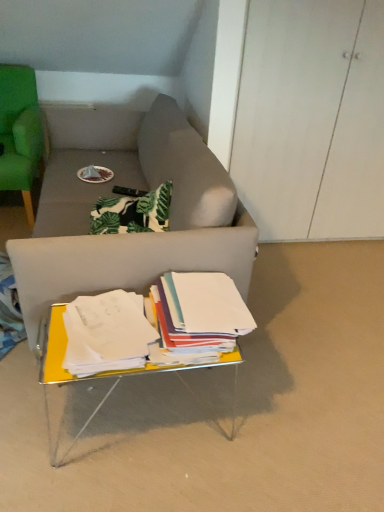
You are a GUI agent. You are given a task and a screenshot of the screen. Output one action in this format:
    pyautogui.click(x=<x>, y=<y>)
    Task: Click on the white paper at center, placed as the 2th paperback book when sorted from right to left
    
    Given the screenshot: What is the action you would take?
    pyautogui.click(x=106, y=333)

What do you see at coordinates (200, 313) in the screenshot? The width and height of the screenshot is (384, 512). I see `white paper at center, the second paperback book in the left-to-right sequence` at bounding box center [200, 313].

The width and height of the screenshot is (384, 512). I want to click on white paper at center, marked as the first paperback book in a right-to-left arrangement, so click(x=200, y=313).

Image resolution: width=384 pixels, height=512 pixels. Describe the element at coordinates (20, 132) in the screenshot. I see `green fabric chair at left` at that location.

What do you see at coordinates (104, 375) in the screenshot? I see `yellow metallic table at lower center` at bounding box center [104, 375].

Identify the location of white paper at center, placed as the 2th paperback book when sorted from right to left. This screenshot has width=384, height=512. (106, 333).

Is point (175, 325) positioned in front of point (47, 380)?

No, (175, 325) is further to viewer.

Between white paper at center, the second paperback book in the left-to-right sequence, and yellow metallic table at lower center, which one has less height?

white paper at center, the second paperback book in the left-to-right sequence.

From a real-world perspective, who is located higher, white paper at center, marked as the first paperback book in a right-to-left arrangement, or yellow metallic table at lower center?

From a 3D spatial view, white paper at center, marked as the first paperback book in a right-to-left arrangement, is above.

Is white paper at center, the second paperback book in the left-to-right sequence, thinner than yellow metallic table at lower center?

Correct, the width of white paper at center, the second paperback book in the left-to-right sequence, is less than that of yellow metallic table at lower center.

Is white paper at center, placed as the 1th paperback book when sorted from left to right, placed right next to green fabric chair at left?

white paper at center, placed as the 1th paperback book when sorted from left to right, and green fabric chair at left are not in contact.

Is white paper at center, placed as the 1th paperback book when sorted from left to right, taller or shorter than green fabric chair at left?

In the image, white paper at center, placed as the 1th paperback book when sorted from left to right, appears to be shorter than green fabric chair at left.

Between white paper at center, placed as the 2th paperback book when sorted from right to left, and green fabric chair at left, which one appears on the right side from the viewer's perspective?

Positioned to the right is white paper at center, placed as the 2th paperback book when sorted from right to left.

Looking at this image, could you measure the distance between white paper at center, placed as the 1th paperback book when sorted from left to right, and green fabric chair at left?

The distance of white paper at center, placed as the 1th paperback book when sorted from left to right, from green fabric chair at left is 1.37 meters.

Is green fabric chair at left inside or outside of white paper at center, the second paperback book in the left-to-right sequence?

green fabric chair at left is spatially situated outside white paper at center, the second paperback book in the left-to-right sequence.

Does green fabric chair at left turn towards white paper at center, the second paperback book in the left-to-right sequence?

No, green fabric chair at left is not turned towards white paper at center, the second paperback book in the left-to-right sequence.

Can you see green fabric chair at left touching white paper at center, marked as the first paperback book in a right-to-left arrangement?

green fabric chair at left and white paper at center, marked as the first paperback book in a right-to-left arrangement, are clearly separated.

Is the surface of green fabric chair at left in direct contact with white paper at center, placed as the 2th paperback book when sorted from right to left?

green fabric chair at left and white paper at center, placed as the 2th paperback book when sorted from right to left, are clearly separated.

In terms of size, does green fabric chair at left appear bigger or smaller than white paper at center, placed as the 2th paperback book when sorted from right to left?

Clearly, green fabric chair at left is larger in size than white paper at center, placed as the 2th paperback book when sorted from right to left.

Which is closer to the camera, (27, 192) or (109, 317)?

The point (109, 317) is closer.

From a real-world perspective, between green fabric chair at left and white paper at center, placed as the 1th paperback book when sorted from left to right, who is vertically higher?

green fabric chair at left is physically above.

Are white paper at center, the second paperback book in the left-to-right sequence, and green fabric chair at left making contact?

They are not placed beside each other.

From the image's perspective, is white paper at center, marked as the first paperback book in a right-to-left arrangement, located beneath green fabric chair at left?

Yes, from the image's perspective, white paper at center, marked as the first paperback book in a right-to-left arrangement, is beneath green fabric chair at left.

I want to click on chair on the left of white paper at center, the second paperback book in the left-to-right sequence, so click(20, 132).

From the image's perspective, who appears lower, white paper at center, placed as the 1th paperback book when sorted from left to right, or yellow metallic table at lower center?

yellow metallic table at lower center is shown below in the image.

Where is `paperback book that is the 1st one when counting backward from the yellow metallic table at lower center`? This screenshot has width=384, height=512. paperback book that is the 1st one when counting backward from the yellow metallic table at lower center is located at coordinates (106, 333).

Considering the positions of point (118, 295) and point (79, 381), is point (118, 295) closer or farther from the camera than point (79, 381)?

Point (118, 295) is closer to the camera than point (79, 381).

Considering the relative sizes of white paper at center, the second paperback book in the left-to-right sequence, and white paper at center, placed as the 1th paperback book when sorted from left to right, in the image provided, is white paper at center, the second paperback book in the left-to-right sequence, smaller than white paper at center, placed as the 1th paperback book when sorted from left to right,?

Actually, white paper at center, the second paperback book in the left-to-right sequence, might be larger than white paper at center, placed as the 1th paperback book when sorted from left to right.

From the image's perspective, who appears lower, white paper at center, marked as the first paperback book in a right-to-left arrangement, or white paper at center, placed as the 1th paperback book when sorted from left to right?

white paper at center, placed as the 1th paperback book when sorted from left to right, is shown below in the image.

Would you say white paper at center, the second paperback book in the left-to-right sequence, is outside white paper at center, placed as the 2th paperback book when sorted from right to left?

Yes, white paper at center, the second paperback book in the left-to-right sequence, is outside of white paper at center, placed as the 2th paperback book when sorted from right to left.

Is white paper at center, placed as the 2th paperback book when sorted from right to left, at the back of white paper at center, marked as the first paperback book in a right-to-left arrangement?

No.

In order to click on paperback book that is the 2nd object located behind the yellow metallic table at lower center in this screenshot , I will do point(200,313).

Starting from the green fabric chair at left, which paperback book is the 1st one to the right? Please provide its 2D coordinates.

[(106, 333)]

Looking at the image, which one is located further to green fabric chair at left, white paper at center, the second paperback book in the left-to-right sequence, or white paper at center, placed as the 2th paperback book when sorted from right to left?

Result: white paper at center, the second paperback book in the left-to-right sequence, is further to green fabric chair at left.

When comparing their distances from white paper at center, placed as the 2th paperback book when sorted from right to left, does green fabric chair at left or yellow metallic table at lower center seem further?

green fabric chair at left lies further to white paper at center, placed as the 2th paperback book when sorted from right to left, than the other object.

Which object lies nearer to the anchor point white paper at center, placed as the 1th paperback book when sorted from left to right, white paper at center, the second paperback book in the left-to-right sequence, or green fabric chair at left?

The object closer to white paper at center, placed as the 1th paperback book when sorted from left to right, is white paper at center, the second paperback book in the left-to-right sequence.

Based on their spatial positions, is white paper at center, placed as the 1th paperback book when sorted from left to right, or white paper at center, the second paperback book in the left-to-right sequence, further from green fabric chair at left?

white paper at center, the second paperback book in the left-to-right sequence, lies further to green fabric chair at left than the other object.

From the image, which object appears to be nearer to white paper at center, marked as the first paperback book in a right-to-left arrangement, yellow metallic table at lower center or green fabric chair at left?

yellow metallic table at lower center is closer to white paper at center, marked as the first paperback book in a right-to-left arrangement.

From the image, which object appears to be farther from yellow metallic table at lower center, white paper at center, placed as the 1th paperback book when sorted from left to right, or green fabric chair at left?

The object further to yellow metallic table at lower center is green fabric chair at left.

Looking at the image, which one is located further to yellow metallic table at lower center, green fabric chair at left or white paper at center, the second paperback book in the left-to-right sequence?

green fabric chair at left.

Which object lies nearer to the anchor point green fabric chair at left, yellow metallic table at lower center or white paper at center, placed as the 1th paperback book when sorted from left to right?

The object closer to green fabric chair at left is white paper at center, placed as the 1th paperback book when sorted from left to right.

Where is `table located between white paper at center, placed as the 2th paperback book when sorted from right to left, and white paper at center, marked as the first paperback book in a right-to-left arrangement, in the left-right direction`? The image size is (384, 512). table located between white paper at center, placed as the 2th paperback book when sorted from right to left, and white paper at center, marked as the first paperback book in a right-to-left arrangement, in the left-right direction is located at coordinates (104, 375).

This screenshot has width=384, height=512. I want to click on table located between green fabric chair at left and white paper at center, the second paperback book in the left-to-right sequence, in the left-right direction, so click(104, 375).

This screenshot has width=384, height=512. What are the coordinates of `paperback book between green fabric chair at left and white paper at center, the second paperback book in the left-to-right sequence` in the screenshot? It's located at (106, 333).